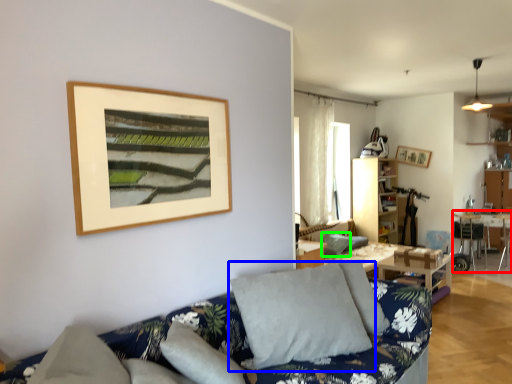
Question: Considering the real-world distances, which object is farthest from table (highlighted by a red box)? pillow (highlighted by a blue box) or pillow (highlighted by a green box)?

Choices:
 (A) pillow
 (B) pillow

Answer: (A)